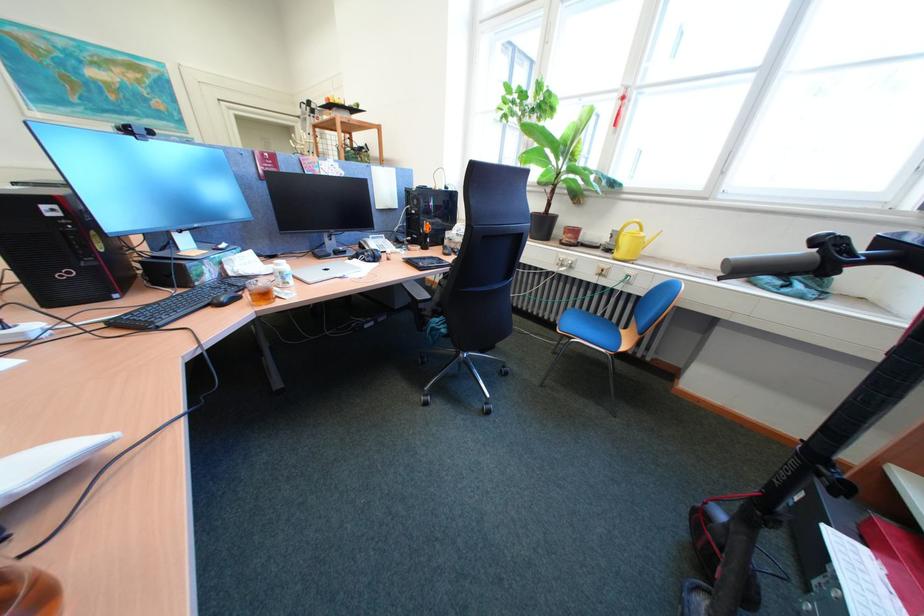
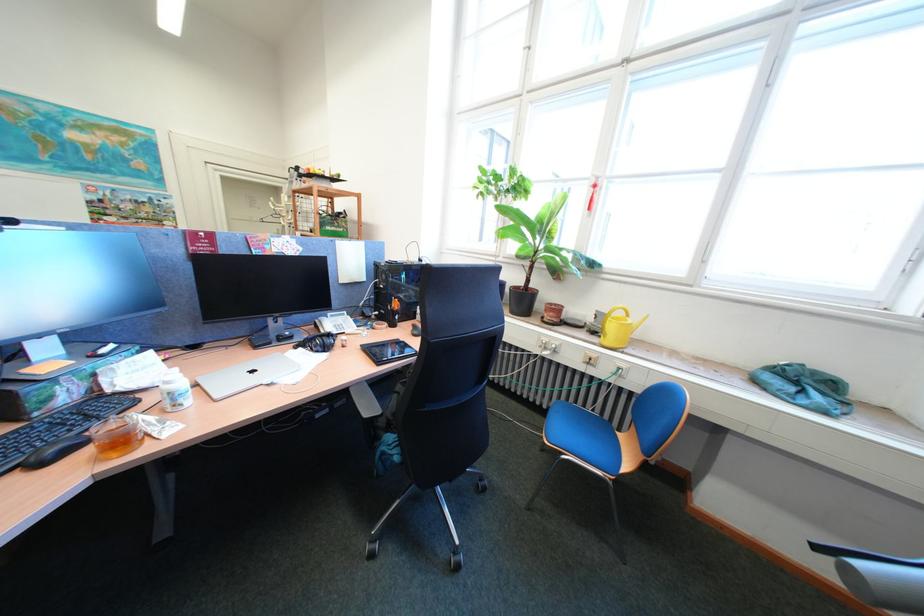
Locate, in the second image, the point that corresponds to point 339,272 in the first image.

(265, 373)